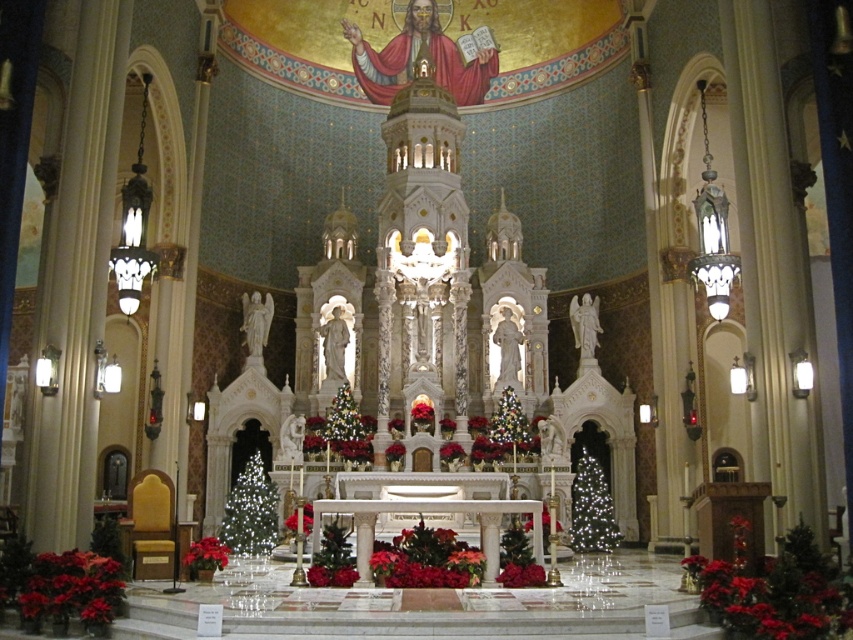
You are standing in the church and want to place a small candle on the table between the illuminated glass christmas tree at lower left and the shiny metallic tree at center. Which tree should the candle be closer to if it needs to be placed exactly in the middle between them?

The candle should be placed exactly between the illuminated glass christmas tree at lower left and the shiny metallic tree at center. Since the illuminated glass christmas tree at lower left is to the left of the shiny metallic tree at center, the candle will be equidistant from both trees when placed in the middle.

You are standing in the church and want to take a photo of the illuminated glass christmas tree at right and the shiny metallic tree at center. Which tree should you focus on first if you want to capture both in a single frame without moving the camera?

You should focus on the illuminated glass christmas tree at right first because it is closer to you than the shiny metallic tree at center, allowing both to be in the frame without moving the camera.